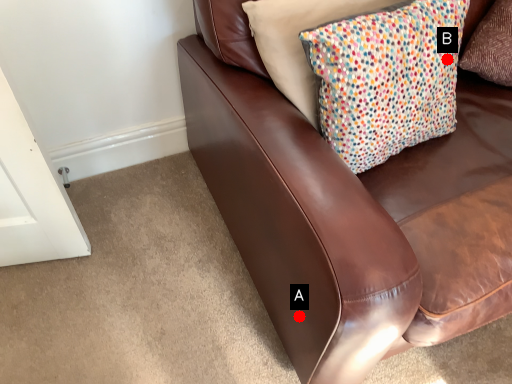
Question: Two points are circled on the image, labeled by A and B beside each circle. Which point is closer to the camera?

Choices:
 (A) A is closer
 (B) B is closer

Answer: (A)